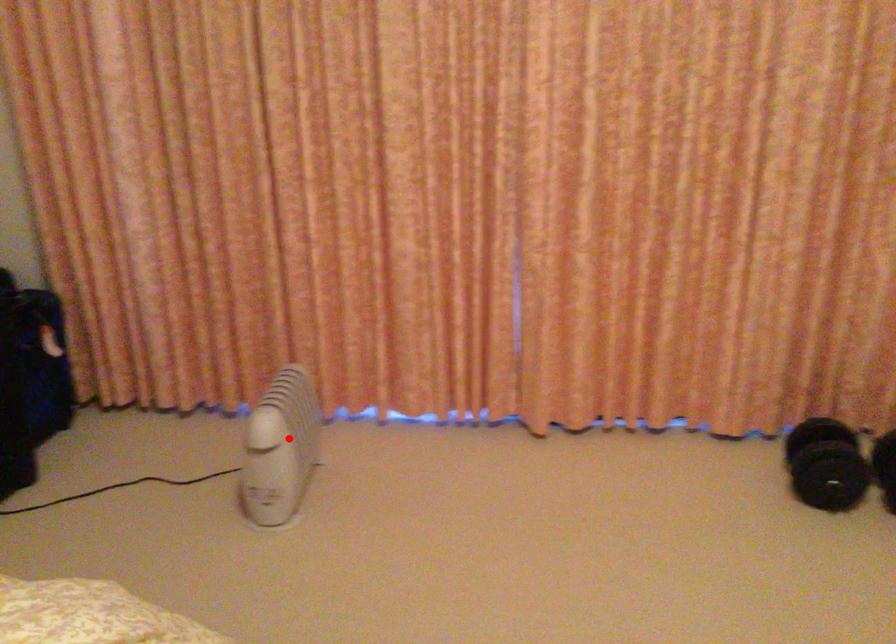
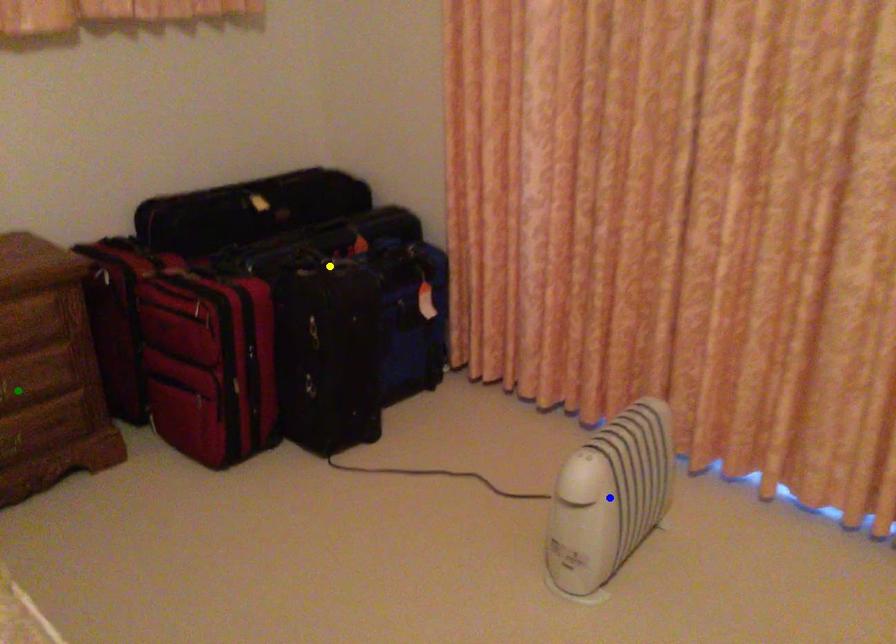
Question: I am providing you with two images of the same scene from different viewpoints. A red point is marked on the first image. You are given multiple points on the second image. Can you choose the point in image 2 that corresponds to the point in image 1?

Choices:
 (A) green point
 (B) yellow point
 (C) blue point

Answer: (C)